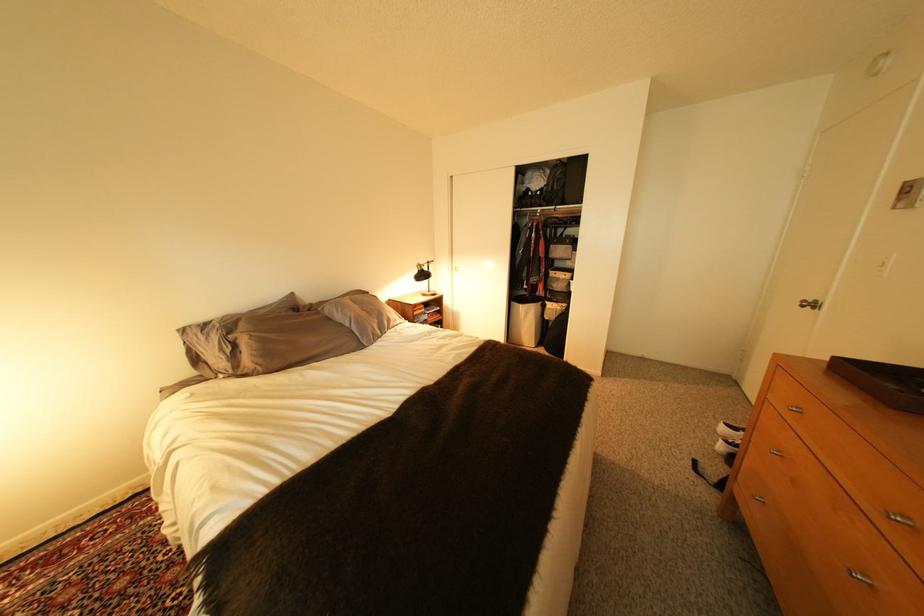
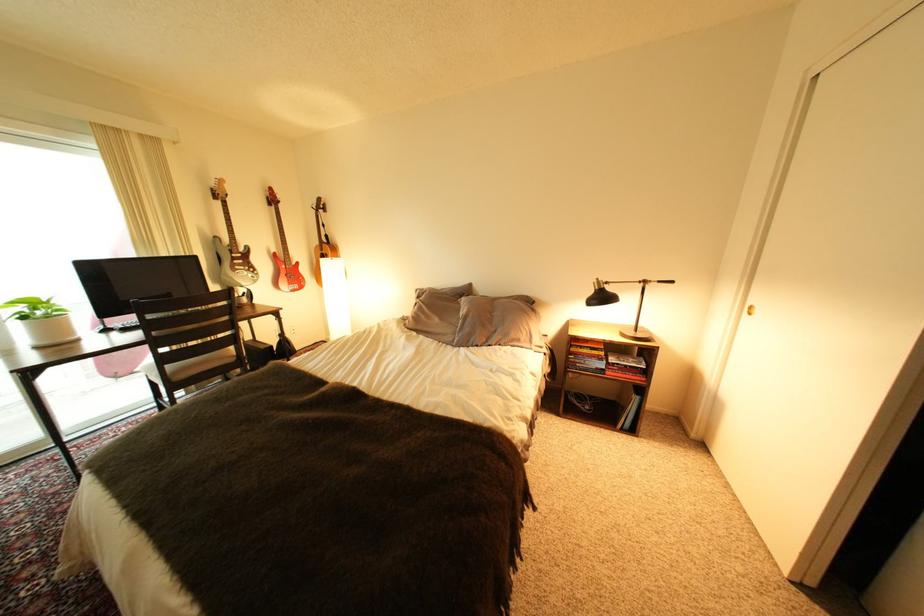
The point at (441, 314) is marked in the first image. Where is the corresponding point in the second image?

(623, 363)